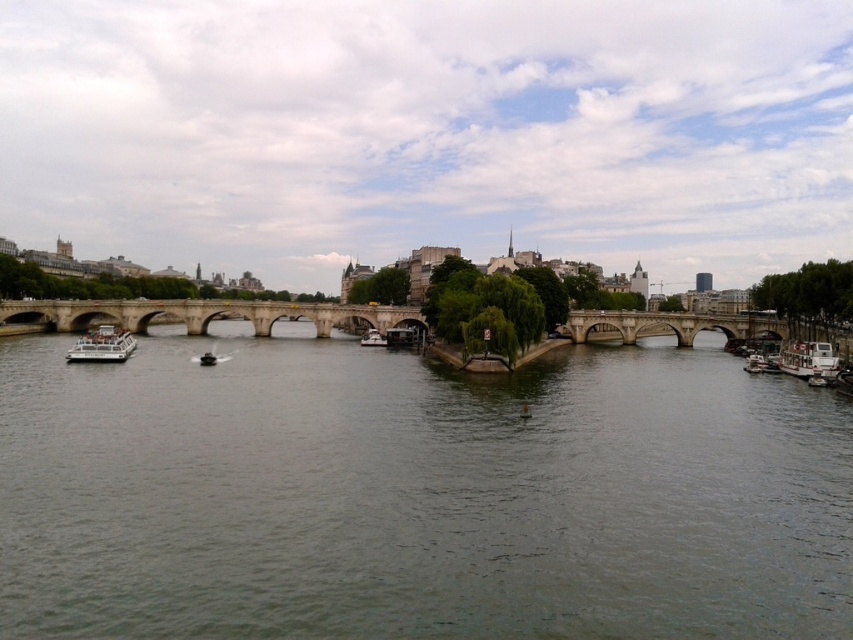
Can you confirm if white matte boat at lower left is positioned to the right of white glossy boat at right?

No, white matte boat at lower left is not to the right of white glossy boat at right.

Which is in front, point (77, 346) or point (798, 342)?

Point (77, 346) is in front.

The image size is (853, 640). I want to click on white matte boat at lower left, so click(x=102, y=346).

Which is more to the left, white glossy boat at right or smooth black boat at center?

Positioned to the left is smooth black boat at center.

The height and width of the screenshot is (640, 853). Describe the element at coordinates (808, 358) in the screenshot. I see `white glossy boat at right` at that location.

Locate an element on the screen. This screenshot has width=853, height=640. white glossy boat at right is located at coordinates (808, 358).

Can you confirm if gray concrete river at center is thinner than stone bridge at center?

No, gray concrete river at center is not thinner than stone bridge at center.

Which is above, gray concrete river at center or stone bridge at center?

stone bridge at center is higher up.

Locate an element on the screen. gray concrete river at center is located at coordinates (416, 493).